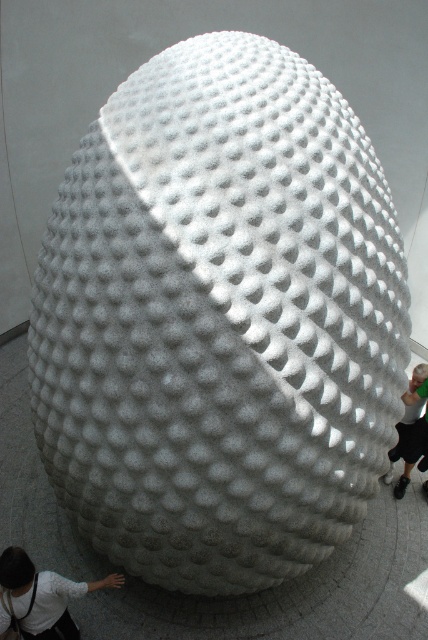
Can you confirm if white textured shirt at lower left is positioned to the right of green fabric pants at lower right?

No, white textured shirt at lower left is not to the right of green fabric pants at lower right.

You are a GUI agent. You are given a task and a screenshot of the screen. Output one action in this format:
    pyautogui.click(x=<x>, y=<y>)
    Task: Click on the white textured shirt at lower left
    
    Given the screenshot: What is the action you would take?
    [39, 596]

Which is behind, point (59, 628) or point (392, 452)?

The point (392, 452) is more distant.

The height and width of the screenshot is (640, 428). I want to click on white textured shirt at lower left, so click(x=39, y=596).